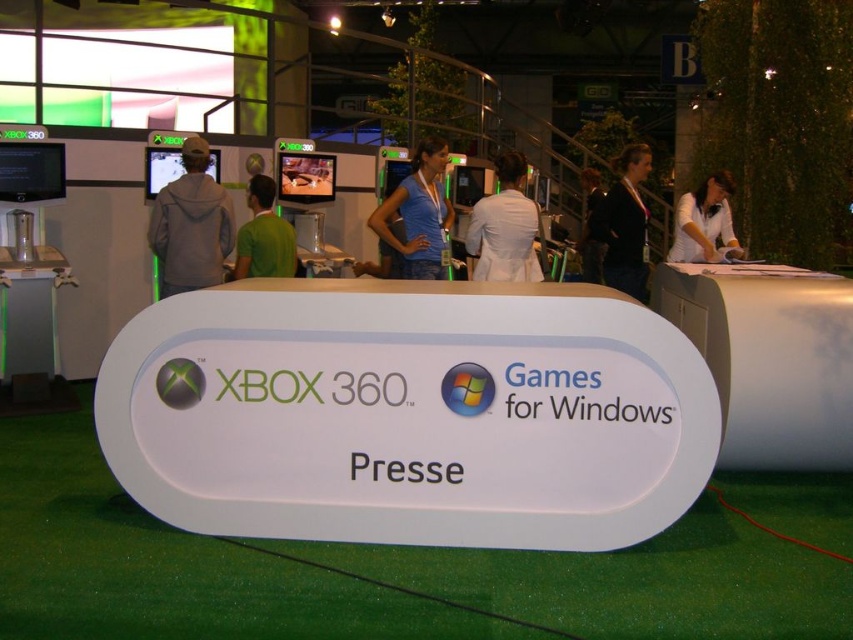
You are at the gaming expo and want to take a photo of the white plastic sign at center and the gray hoodie at left. Which object should you focus on first if you want to capture both in a single frame without moving the camera?

You should focus on the white plastic sign at center first because it is wider than the gray hoodie at left, so positioning the camera to include its larger width will naturally include the narrower gray hoodie at left in the frame as well.

You are at the gaming expo and want to take a photo of the white plastic sign at center and the gray hoodie at left together in the frame. Given that your camera has a maximum focus range of 2 meters, will you be able to capture both objects in a single shot without moving?

The white plastic sign at center and gray hoodie at left are 1.96 meters apart, so yes, you can capture both in a single shot since the distance between them is within the camera focus range of 2 meters.